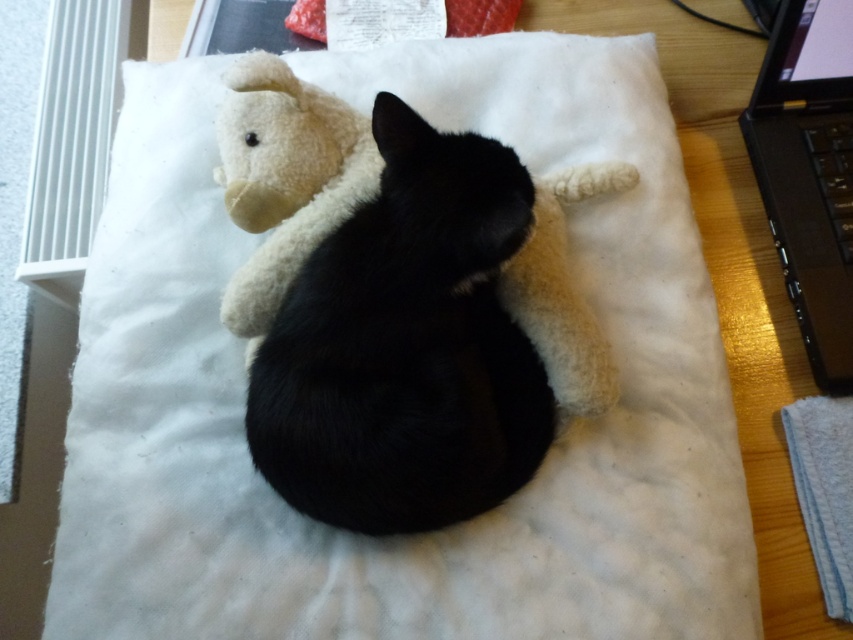
Question: From the image, what is the correct spatial relationship of black fur cat at center in relation to black plastic laptop at right?

Choices:
 (A) below
 (B) above

Answer: (A)

Question: Which of the following is the farthest from the observer?

Choices:
 (A) (811, 8)
 (B) (431, 225)

Answer: (A)

Question: Which of the following is the farthest from the observer?

Choices:
 (A) (780, 35)
 (B) (508, 422)

Answer: (A)

Question: Observing the image, what is the correct spatial positioning of black fur cat at center in reference to black plastic laptop at right?

Choices:
 (A) above
 (B) below

Answer: (B)

Question: Can you confirm if black fur cat at center is wider than black plastic laptop at right?

Choices:
 (A) yes
 (B) no

Answer: (A)

Question: Which object appears farthest from the camera in this image?

Choices:
 (A) black fur cat at center
 (B) black plastic laptop at right

Answer: (B)